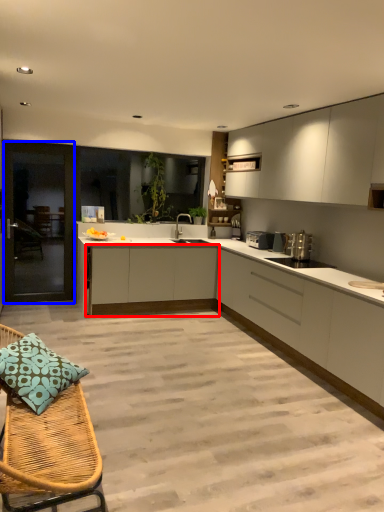
Question: Which object is closer to the camera taking this photo, cabinetry (highlighted by a red box) or screen door (highlighted by a blue box)?

Choices:
 (A) cabinetry
 (B) screen door

Answer: (A)